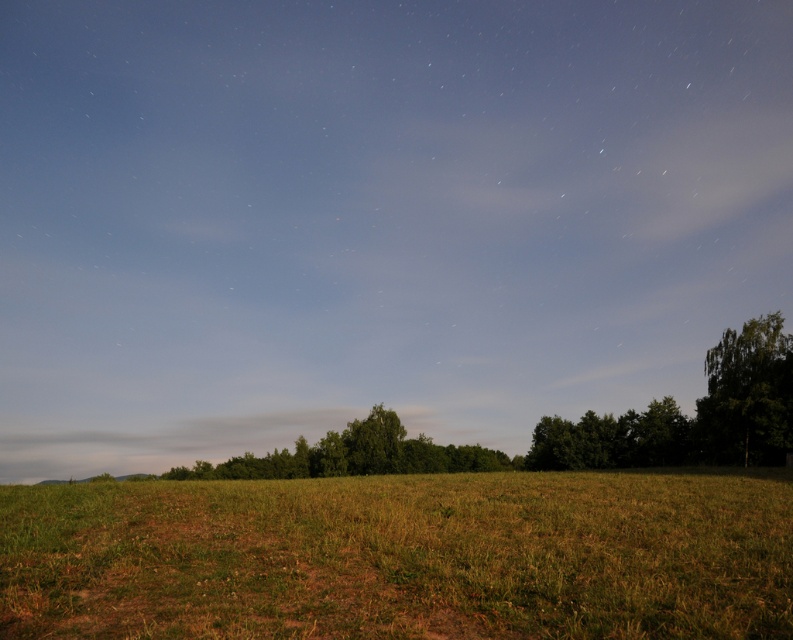
Question: Is green grassy field at lower center smaller than green leafy tree at center?

Choices:
 (A) no
 (B) yes

Answer: (B)

Question: Which point is closer to the camera taking this photo?

Choices:
 (A) (297, 461)
 (B) (715, 452)

Answer: (B)

Question: Considering the real-world distances, which object is closest to the green leafy tree at center?

Choices:
 (A) green leafy tree at right
 (B) green grassy field at lower center

Answer: (A)

Question: Can you confirm if green leafy tree at right is bigger than green leafy tree at center?

Choices:
 (A) yes
 (B) no

Answer: (B)

Question: Which point is farther to the camera?

Choices:
 (A) green leafy tree at right
 (B) green leafy tree at center
 (C) green grassy field at lower center

Answer: (B)

Question: Does green grassy field at lower center have a greater width compared to green leafy tree at right?

Choices:
 (A) yes
 (B) no

Answer: (A)